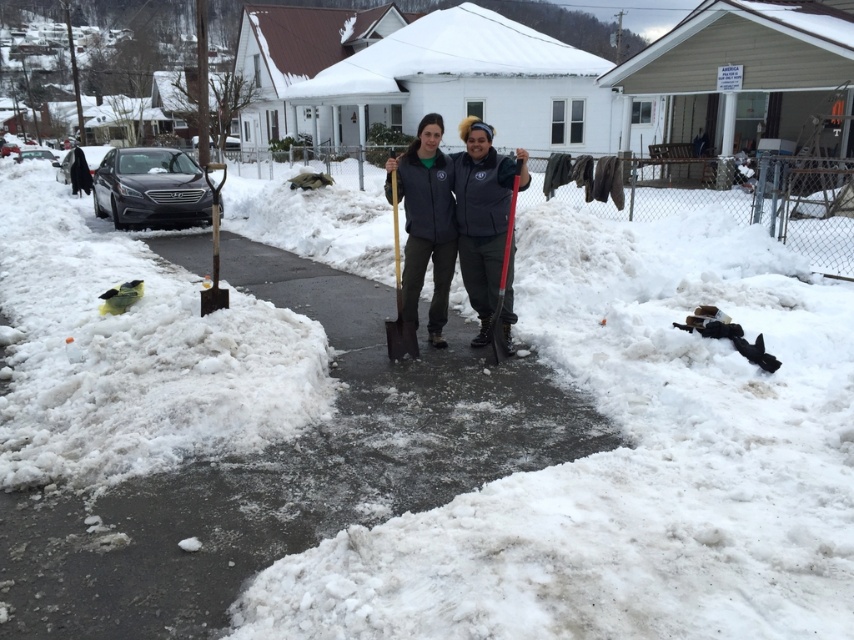
Image resolution: width=854 pixels, height=640 pixels. I want to click on dark gray fleece jackets at center, so click(x=457, y=218).

Between point (413, 268) and point (393, 170), which one is positioned behind?

Positioned behind is point (413, 268).

Between point (486, 218) and point (407, 355), which one is positioned behind?

Point (407, 355)

The width and height of the screenshot is (854, 640). I want to click on dark gray fleece jackets at center, so click(457, 218).

Between wooden shovel at center and red plastic shovel at center, which one appears on the left side from the viewer's perspective?

wooden shovel at center is more to the left.

Who is positioned more to the right, wooden shovel at center or red plastic shovel at center?

red plastic shovel at center

Locate an element on the screen. This screenshot has height=640, width=854. wooden shovel at center is located at coordinates (398, 296).

Locate an element on the screen. The height and width of the screenshot is (640, 854). wooden shovel at center is located at coordinates (398, 296).

Can you confirm if dark gray fleece jackets at center is positioned to the left of matte gray jacket at center?

In fact, dark gray fleece jackets at center is to the right of matte gray jacket at center.

Is dark gray fleece jackets at center wider than matte gray jacket at center?

No, dark gray fleece jackets at center is not wider than matte gray jacket at center.

The width and height of the screenshot is (854, 640). In order to click on dark gray fleece jackets at center in this screenshot , I will do `click(457, 218)`.